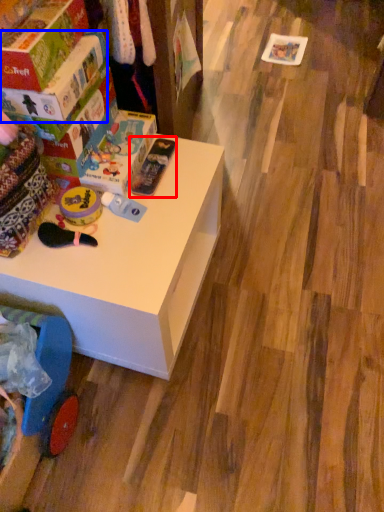
Question: Among these objects, which one is farthest to the camera, toy (highlighted by a red box) or box (highlighted by a blue box)?

Choices:
 (A) toy
 (B) box

Answer: (A)